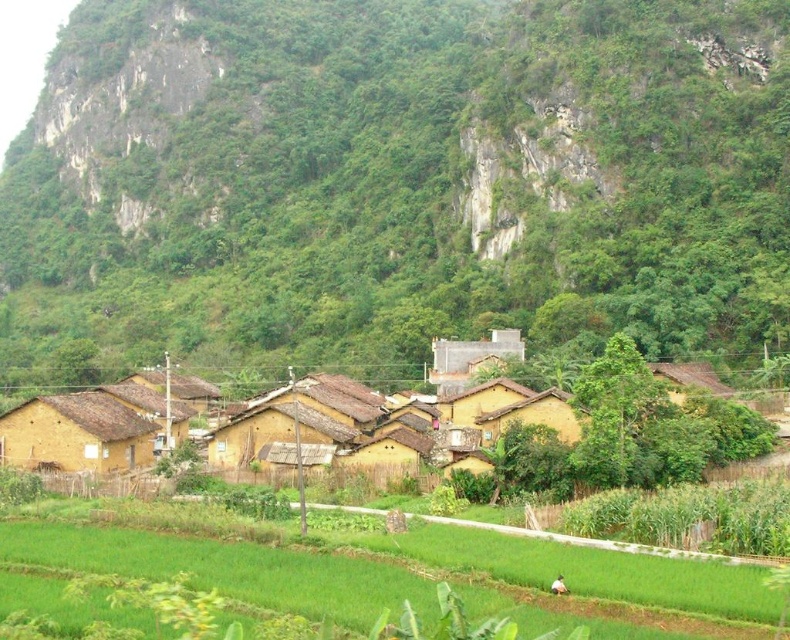
Does yellow clay houses at center appear over yellow mud hut at lower left?

Yes.

Does yellow clay houses at center have a smaller size compared to yellow mud hut at lower left?

Incorrect, yellow clay houses at center is not smaller in size than yellow mud hut at lower left.

Locate an element on the screen. This screenshot has width=790, height=640. yellow clay houses at center is located at coordinates (499, 420).

Which is in front, point (608, 563) or point (125, 464)?

Point (608, 563)

Is point (705, 577) less distant than point (10, 420)?

Yes, point (705, 577) is closer to viewer.

Locate an element on the screen. This screenshot has width=790, height=640. green grass at lower center is located at coordinates (392, 568).

Is yellow clay houses at center bigger than green grass at lower center?

Yes, yellow clay houses at center is bigger than green grass at lower center.

Which of these two, yellow clay houses at center or green grass at lower center, stands shorter?

green grass at lower center

Does point (311, 428) come in front of point (502, 547)?

No, (311, 428) is further to viewer.

You are a GUI agent. You are given a task and a screenshot of the screen. Output one action in this format:
    pyautogui.click(x=<x>, y=<y>)
    Task: Click on the yellow clay houses at center
    
    Given the screenshot: What is the action you would take?
    pyautogui.click(x=499, y=420)